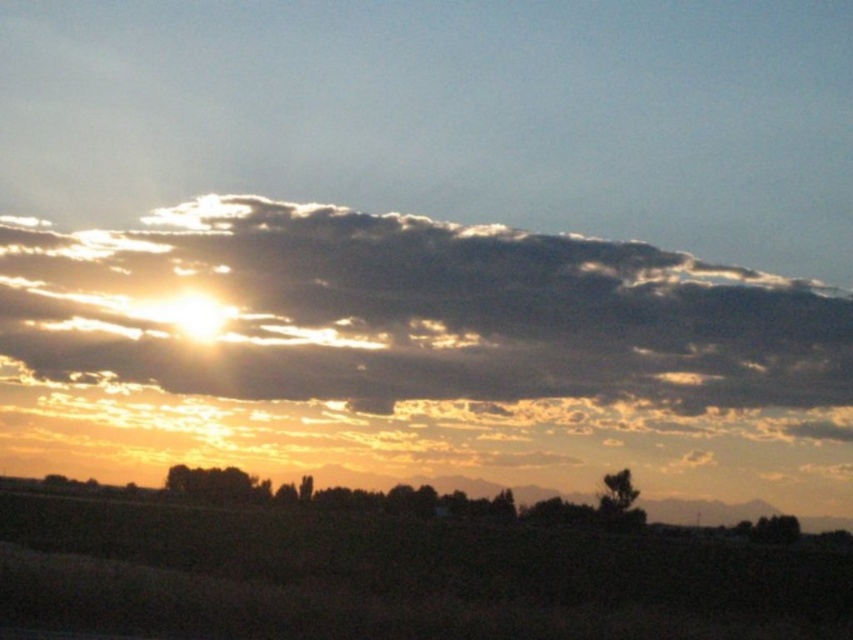
Question: Can you confirm if sandy brown cloud at upper center is wider than brown grassland at lower center?

Choices:
 (A) no
 (B) yes

Answer: (A)

Question: Is sandy brown cloud at upper center thinner than brown grassland at lower center?

Choices:
 (A) no
 (B) yes

Answer: (B)

Question: From the image, what is the correct spatial relationship of sandy brown cloud at upper center in relation to brown grassland at lower center?

Choices:
 (A) right
 (B) left

Answer: (A)

Question: Which of the following is the farthest from the observer?

Choices:
 (A) (850, 529)
 (B) (212, 275)

Answer: (A)

Question: Which of the following is the farthest from the observer?

Choices:
 (A) (117, 484)
 (B) (531, 236)

Answer: (A)

Question: Which object is farther from the camera taking this photo?

Choices:
 (A) sandy brown cloud at upper center
 (B) brown grassland at lower center

Answer: (A)